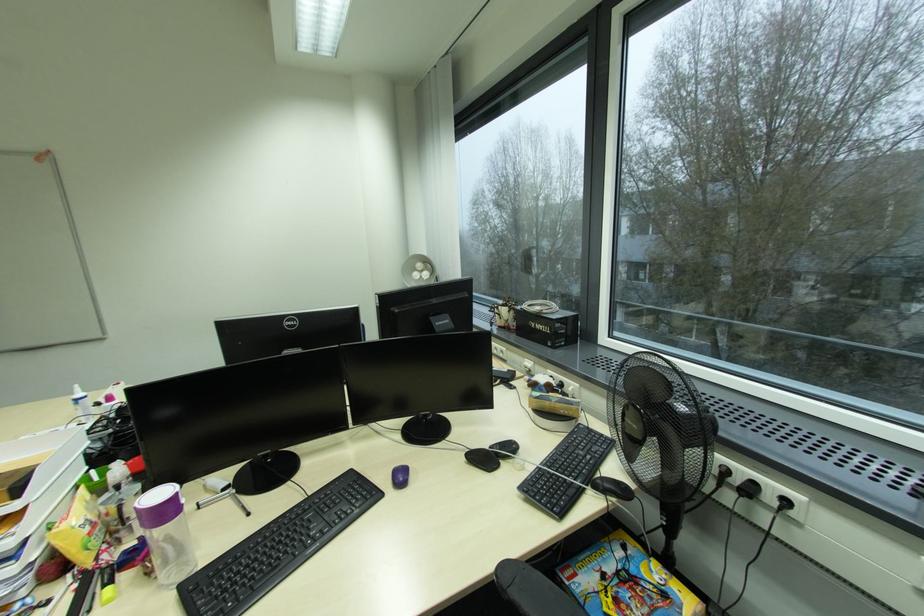
Which object does [399,476] point to?

It refers to a purple computer mouse.